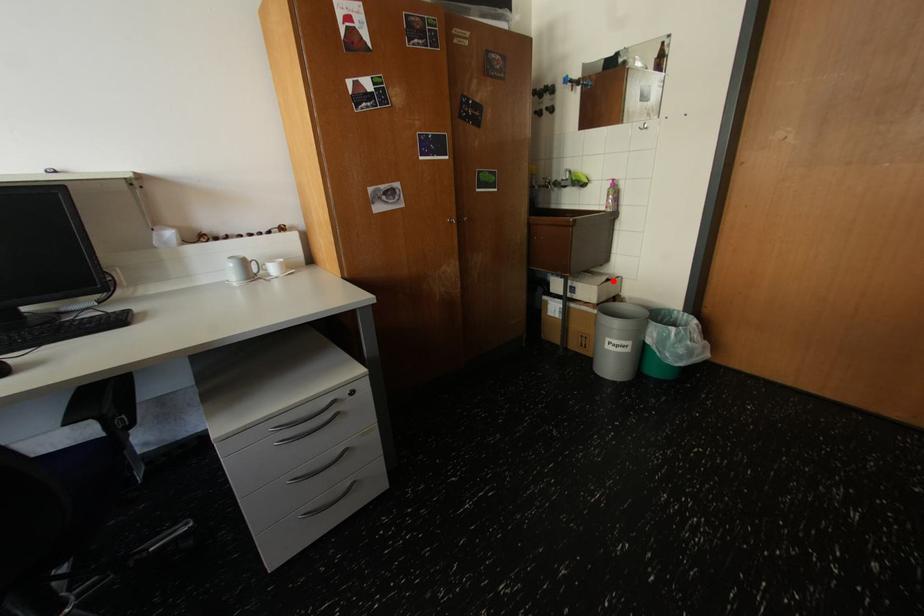
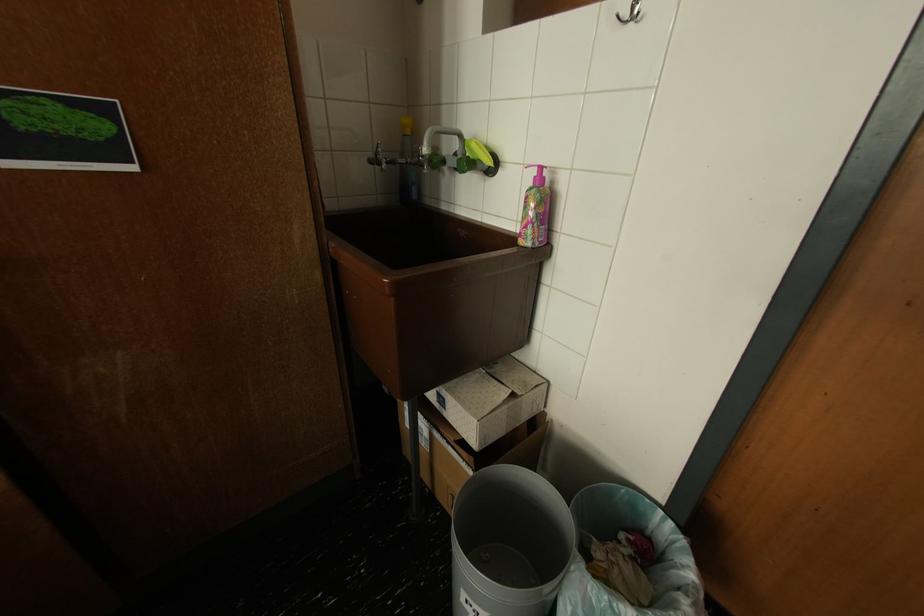
Question: I am providing you with two images of the same scene from different viewpoints. A red point is marked on the first image. Can you still see the location of the red point in image 2?

Choices:
 (A) Yes
 (B) No

Answer: (A)